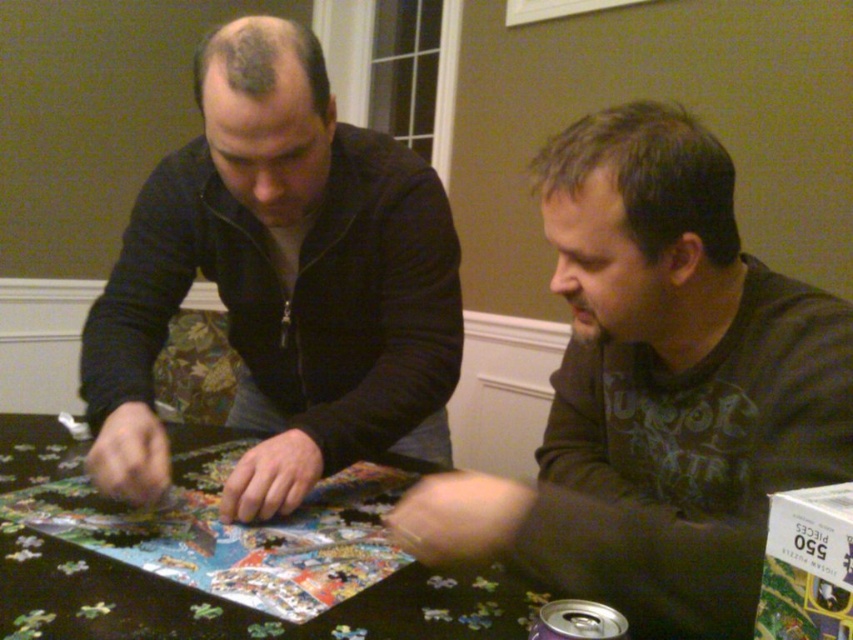
What are the coordinates of the dark brown shirt at center?

The coordinates of the dark brown shirt at center are at point (657, 390).

You are a robot arm trying to pick up the black puzzle pieces at center. The minimum distance you need to be from the dark brown shirt at center to avoid collision is 12 inches. Can you safely pick up the pieces?

The dark brown shirt at center is 11.58 inches away from the black puzzle pieces at center. Since the required minimum distance to avoid collision is 12 inches, the distance is insufficient. Therefore, picking up the pieces may result in a collision with the dark brown shirt at center.